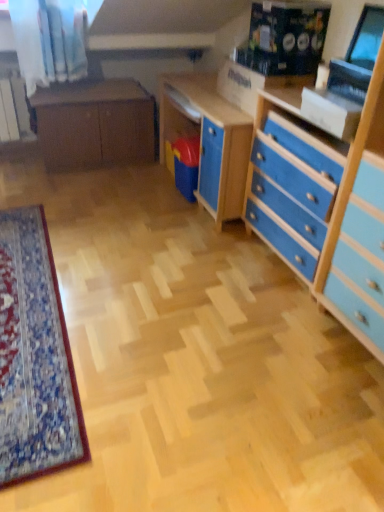
What do you see at coordinates (325, 206) in the screenshot? I see `blue painted wood chest of drawers at right` at bounding box center [325, 206].

Describe the element at coordinates (366, 38) in the screenshot. I see `matte black monitor at upper right` at that location.

Identify the location of blue painted wood chest of drawers at right. Image resolution: width=384 pixels, height=512 pixels. (325, 206).

Is point (382, 94) less distant than point (123, 113)?

Yes, it is.

Is blue painted wood chest of drawers at right inside or outside of matte brown cabinet at center?

blue painted wood chest of drawers at right is not inside matte brown cabinet at center, it's outside.

Can you tell me how much blue painted wood chest of drawers at right and matte brown cabinet at center differ in facing direction?

90 degrees.

From a real-world perspective, is blue painted wood chest of drawers at right over matte black monitor at upper right?

No, from a real-world perspective, blue painted wood chest of drawers at right is not on top of matte black monitor at upper right.

Would you say matte black monitor at upper right is part of blue painted wood chest of drawers at right's contents?

Actually, matte black monitor at upper right is outside blue painted wood chest of drawers at right.

Can you confirm if blue painted wood chest of drawers at right is smaller than matte black monitor at upper right?

A: No, blue painted wood chest of drawers at right is not smaller than matte black monitor at upper right.

Does point (359, 36) come closer to viewer compared to point (298, 129)?

That is True.

Does matte black monitor at upper right lie in front of blue painted wood chest of drawers at right?

No, it is not.

Looking at this image, from a real-world perspective, who is located lower, matte black monitor at upper right or blue painted wood chest of drawers at right?

blue painted wood chest of drawers at right, from a real-world perspective.

Is the depth of matte brown cabinet at center less than that of blue painted wood chest of drawers at right?

No, matte brown cabinet at center is behind blue painted wood chest of drawers at right.

Which is closer to the camera, (128, 118) or (356, 336)?

Point (128, 118) appears to be farther away from the viewer than point (356, 336).

Is matte brown cabinet at center not near blue painted wood chest of drawers at right?

Yes, matte brown cabinet at center is far from blue painted wood chest of drawers at right.

Is the position of matte brown cabinet at center more distant than that of matte black monitor at upper right?

Yes, it is.

Looking at this image, is matte brown cabinet at center facing away from matte black monitor at upper right?

matte brown cabinet at center is not turned away from matte black monitor at upper right.

From the image's perspective, is matte brown cabinet at center above or below matte black monitor at upper right?

From the image's perspective, matte brown cabinet at center appears above matte black monitor at upper right.

Is matte black monitor at upper right inside matte brown cabinet at center?

No, matte black monitor at upper right is not inside matte brown cabinet at center.

From the image's perspective, who appears lower, matte black monitor at upper right or matte brown cabinet at center?

matte black monitor at upper right.

Identify the location of table located above the matte black monitor at upper right (from the image's perspective). (94, 124).

Is there a large distance between matte black monitor at upper right and matte brown cabinet at center?

Yes.

Which object is further away from the camera, matte black monitor at upper right or matte brown cabinet at center?

matte brown cabinet at center is behind.

This screenshot has height=512, width=384. I want to click on table that appears below the blue painted wood chest of drawers at right (from a real-world perspective), so (x=94, y=124).

The width and height of the screenshot is (384, 512). I want to click on computer monitor that is above the blue painted wood chest of drawers at right (from a real-world perspective), so click(x=366, y=38).

From the image, which object appears to be farther from matte brown cabinet at center, matte black monitor at upper right or blue painted wood chest of drawers at right?

The object further to matte brown cabinet at center is matte black monitor at upper right.

Which object lies nearer to the anchor point matte black monitor at upper right, matte brown cabinet at center or blue painted wood chest of drawers at right?

blue painted wood chest of drawers at right is positioned closer to the anchor matte black monitor at upper right.

In the scene shown: Looking at the image, which one is located closer to matte brown cabinet at center, blue painted wood chest of drawers at right or matte black monitor at upper right?

blue painted wood chest of drawers at right lies closer to matte brown cabinet at center than the other object.

When comparing their distances from blue painted wood chest of drawers at right, does matte black monitor at upper right or matte brown cabinet at center seem further?

matte brown cabinet at center is further to blue painted wood chest of drawers at right.

Looking at the image, which one is located closer to matte black monitor at upper right, blue painted wood chest of drawers at right or matte brown cabinet at center?

blue painted wood chest of drawers at right.

From the image, which object appears to be farther from blue painted wood chest of drawers at right, matte brown cabinet at center or matte black monitor at upper right?

Based on the image, matte brown cabinet at center appears to be further to blue painted wood chest of drawers at right.

Locate an element on the screen. The height and width of the screenshot is (512, 384). chest of drawers between matte brown cabinet at center and matte black monitor at upper right in the horizontal direction is located at coordinates (325, 206).